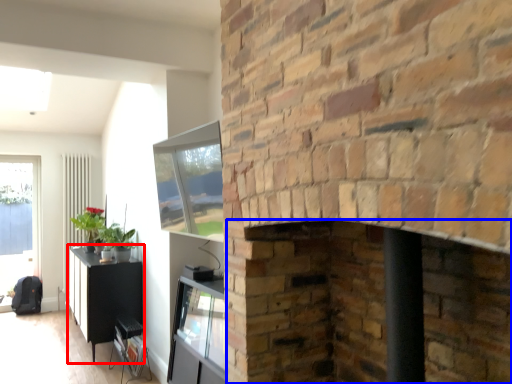
Question: Which object is closer to the camera taking this photo, table (highlighted by a red box) or fireplace (highlighted by a blue box)?

Choices:
 (A) table
 (B) fireplace

Answer: (B)